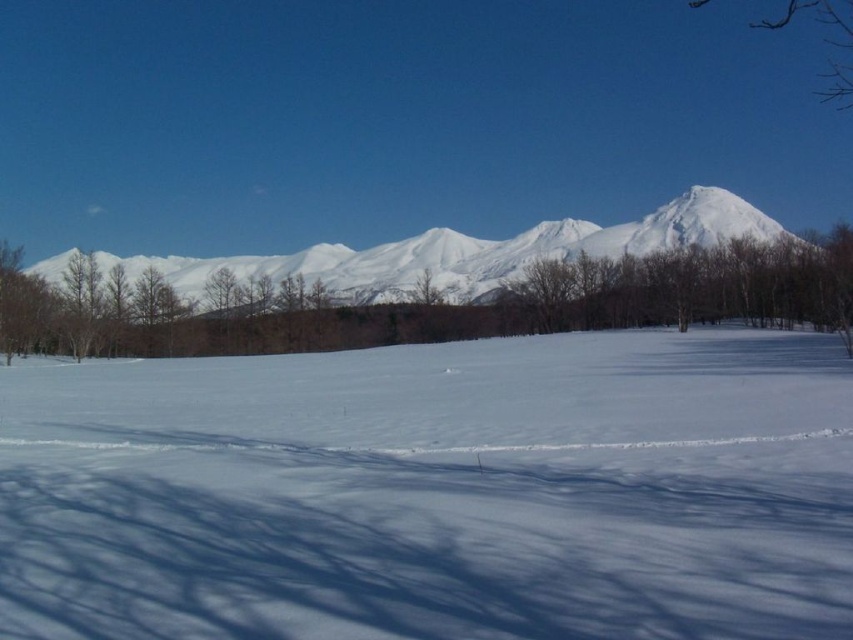
You are standing at the point marked as point (434, 492) in the image. Looking around, you see white snow at center. What is directly beneath your feet?

The point (434, 492) indicates white snow at center, so the area directly beneath your feet is covered in white snow at center.